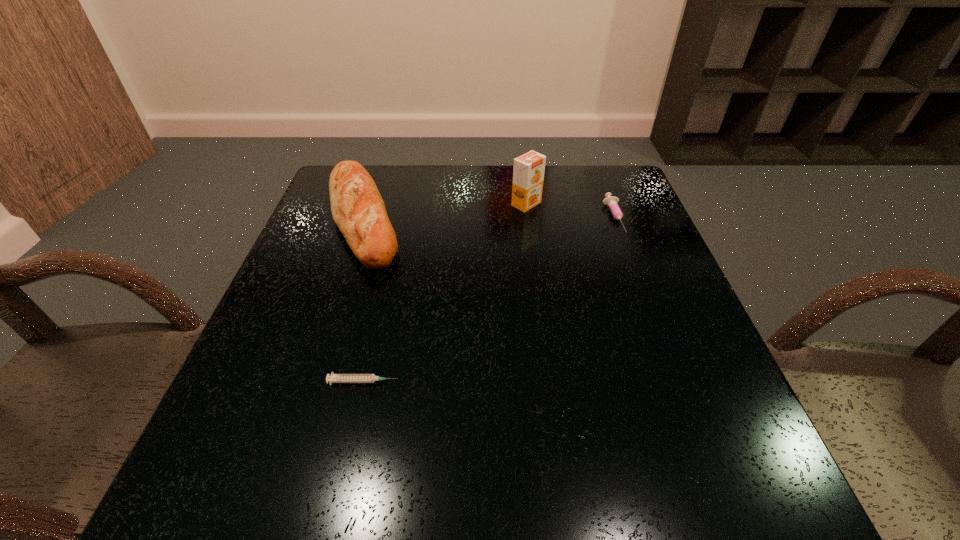
At what (x,y) coordinates should I click in order to perform the action: click on orange juice. Please return your answer as a coordinate pair (x, y). Looking at the image, I should click on (528, 172).

Locate an element on the screen. The width and height of the screenshot is (960, 540). the third object from left to right is located at coordinates (528, 172).

The height and width of the screenshot is (540, 960). Identify the location of baguet. (358, 210).

The image size is (960, 540). What are the coordinates of `the farther syringe` in the screenshot? It's located at (612, 202).

What are the coordinates of `the second shortest object` in the screenshot? It's located at (612, 202).

You are a GUI agent. You are given a task and a screenshot of the screen. Output one action in this format:
    pyautogui.click(x=<x>, y=<y>)
    Task: Click on the shorter syringe
    
    Given the screenshot: What is the action you would take?
    pyautogui.click(x=333, y=378)

Locate an element on the screen. the nearer syringe is located at coordinates (333, 378).

Locate an element on the screen. free spot located 0.330m on the left of the orange juice is located at coordinates (385, 204).

Find the location of a particular element. Image resolution: width=960 pixels, height=540 pixels. free space located on the right of the baguet is located at coordinates coord(427,218).

Identify the location of free space located on the left of the farther syringe. (471, 217).